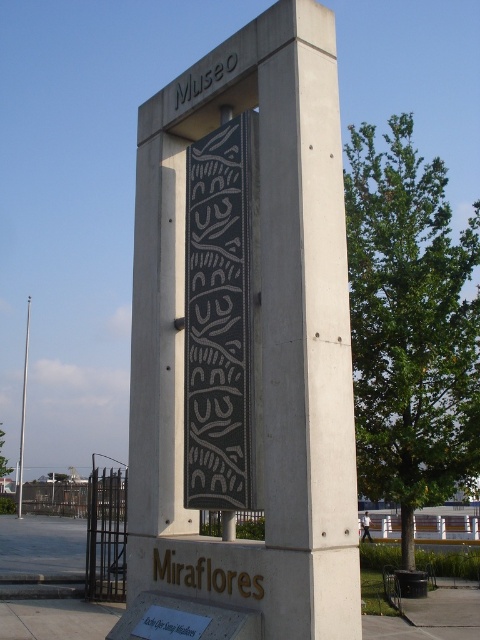
You are standing in front of the monument and want to read both the gold metallic text at lower center and the gray concrete sign at upper center. Which one do you need to look down towards first?

You need to look down towards the gold metallic text at lower center first because it is closer to the viewer than the gray concrete sign at upper center.

You are standing in front of the monument and want to read both the gold metallic text at lower center and the gray concrete sign at upper center. If your maximum comfortable reading distance is 3 meters, can you read both without moving closer?

The distance between the gold metallic text at lower center and gray concrete sign at upper center is 4.21 meters, which exceeds your comfortable reading distance of 3 meters. Therefore, you would need to move closer to read both comfortably.